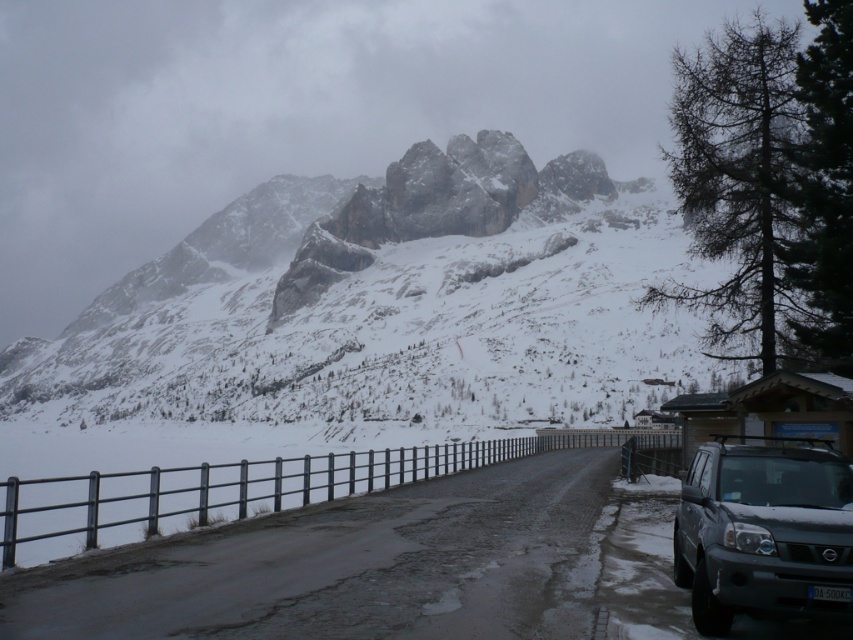
Question: Is snowy granite mountain at upper center above silver metallic suv at right?

Choices:
 (A) no
 (B) yes

Answer: (B)

Question: Can you confirm if smooth asphalt road at center is bigger than silver metallic suv at right?

Choices:
 (A) no
 (B) yes

Answer: (B)

Question: From the image, what is the correct spatial relationship of smooth asphalt road at center in relation to silver metallic suv at right?

Choices:
 (A) below
 (B) above

Answer: (A)

Question: Which point appears farthest from the camera in this image?

Choices:
 (A) (700, 445)
 (B) (440, 13)
 (C) (434, 266)

Answer: (B)

Question: Which object is the closest to the white snow mountain at upper center?

Choices:
 (A) silver metallic suv at right
 (B) smooth asphalt road at center
 (C) snowy granite mountain at upper center

Answer: (C)

Question: Which object appears closest to the camera in this image?

Choices:
 (A) smooth asphalt road at center
 (B) white snow mountain at upper center
 (C) snowy granite mountain at upper center

Answer: (A)